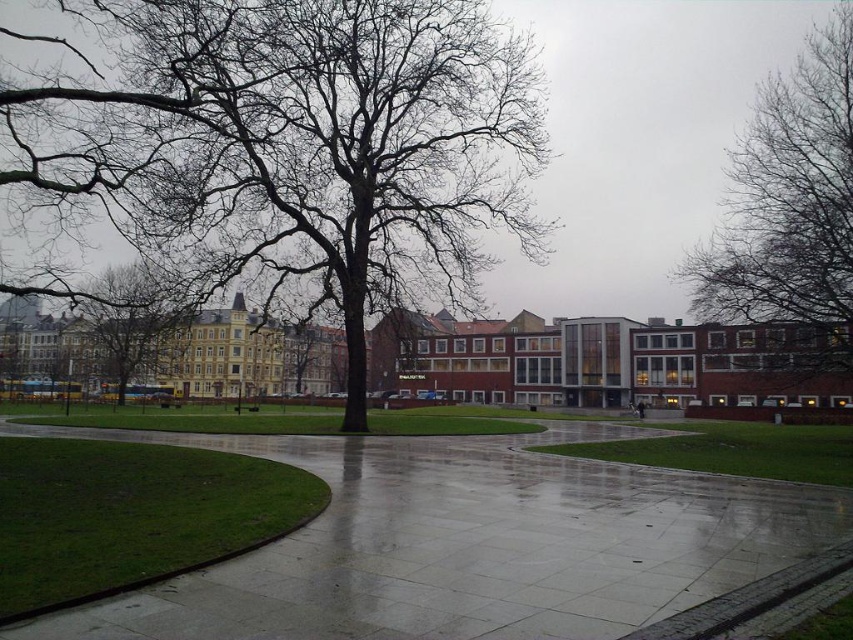
Question: Which is farther from the brown bark tree at left?

Choices:
 (A) bare branches at center
 (B) glossy concrete pavement at center
 (C) bare branches at upper right

Answer: (C)

Question: Can you confirm if bare branches at center is positioned to the left of bare branches at upper right?

Choices:
 (A) yes
 (B) no

Answer: (A)

Question: Does bare branches at center have a lesser width compared to bare branches at upper right?

Choices:
 (A) yes
 (B) no

Answer: (A)

Question: Among these points, which one is farthest from the camera?

Choices:
 (A) click(x=142, y=216)
 (B) click(x=770, y=227)
 (C) click(x=138, y=317)
 (D) click(x=608, y=515)

Answer: (C)

Question: Which object is the farthest from the glossy concrete pavement at center?

Choices:
 (A) bare branches at center
 (B) bare branches at upper right
 (C) brown bark tree at left

Answer: (C)

Question: Is bare branches at center to the left of brown bark tree at left from the viewer's perspective?

Choices:
 (A) no
 (B) yes

Answer: (A)